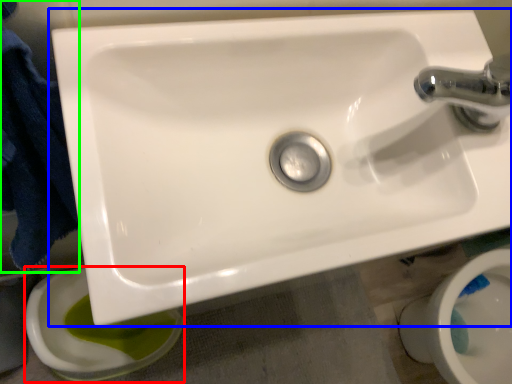
Question: Which object is positioned closest to toilet bowl (highlighted by a red box)? Select from sink (highlighted by a blue box) and bath towel (highlighted by a green box).

Choices:
 (A) sink
 (B) bath towel

Answer: (B)